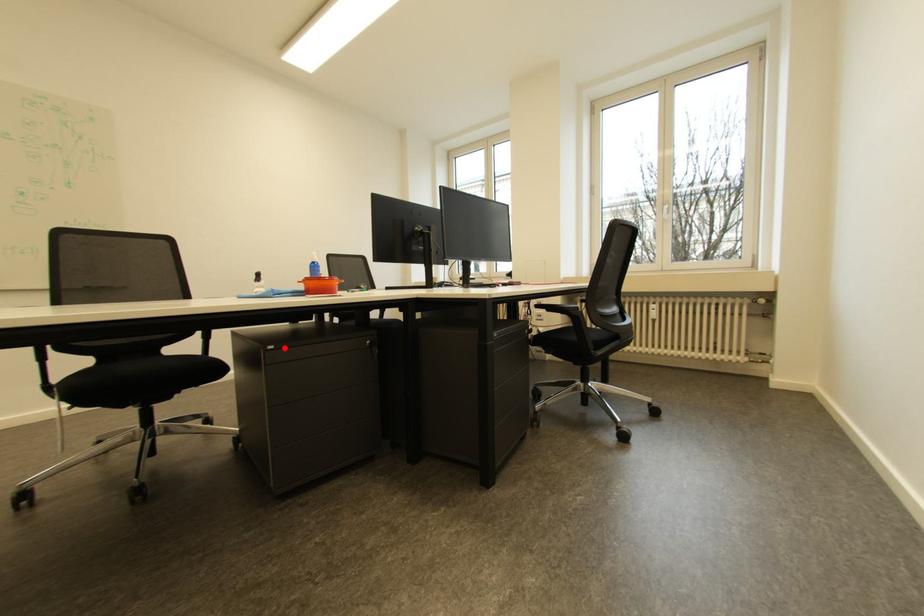
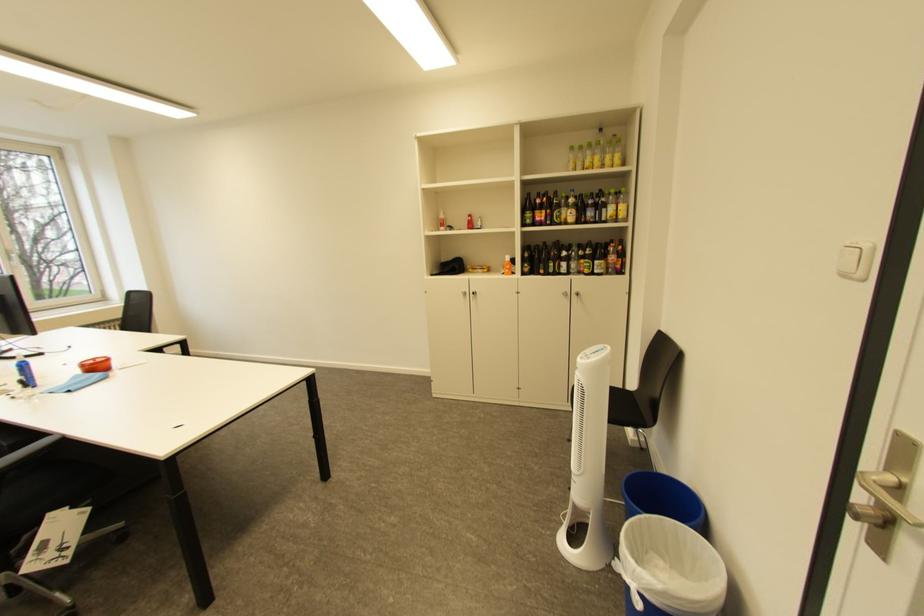
Question: I am providing you with two images of the same scene from different viewpoints. A red point is marked on the first image. Is the red point's position out of view in image 2?

Choices:
 (A) Yes
 (B) No

Answer: (A)